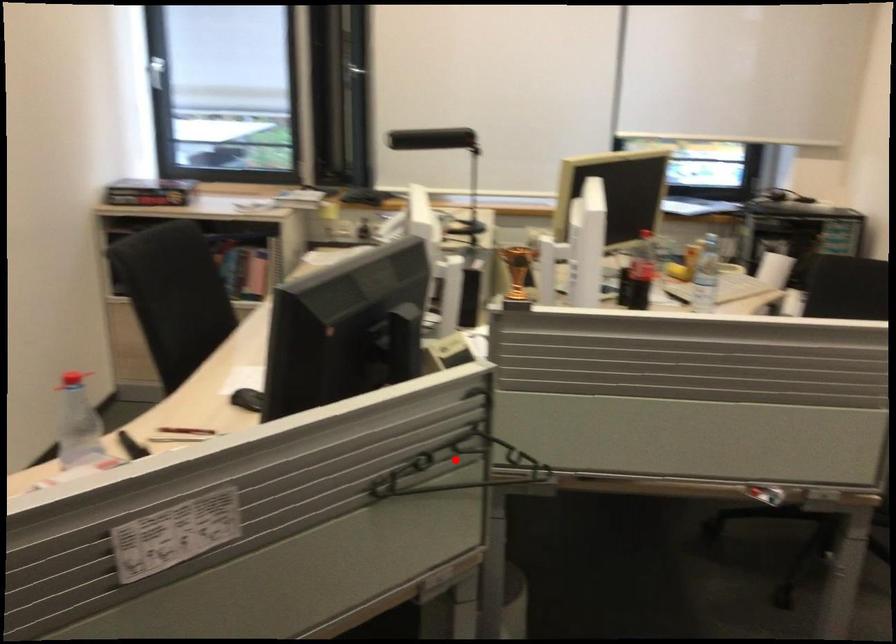
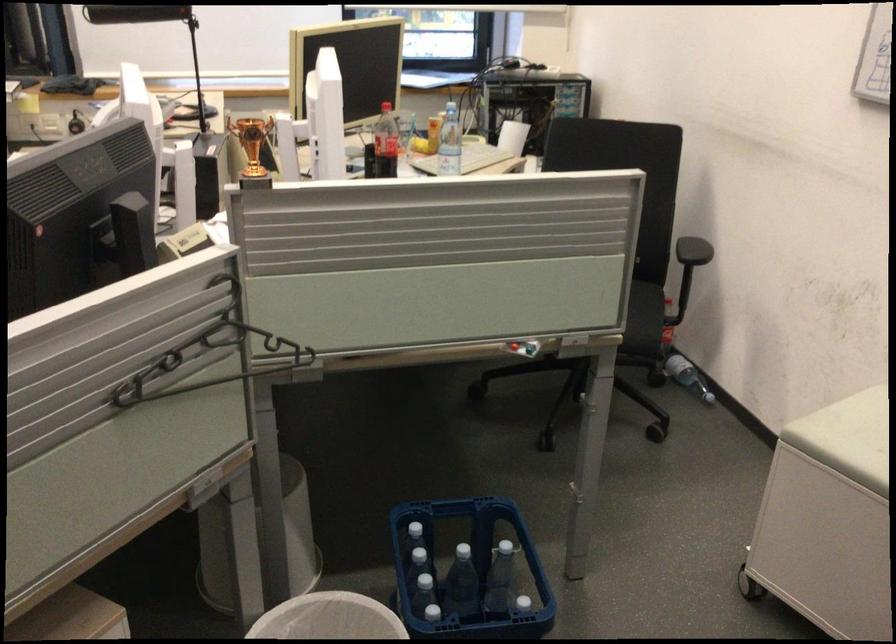
Where in the second image is the point corresponding to the highlighted location from the first image?

(209, 355)